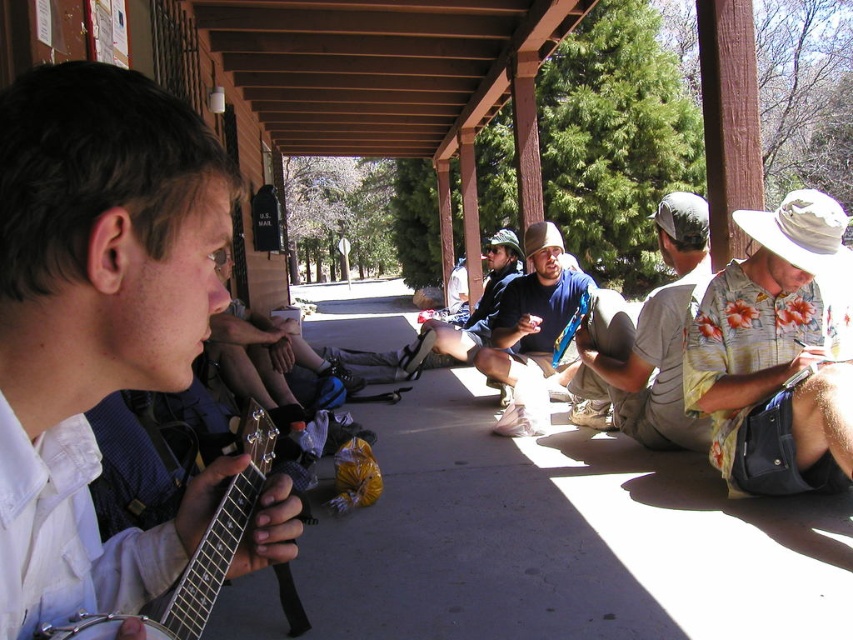
Which of these two, floral cotton shirt at right or gray striped shirt at center, stands taller?

gray striped shirt at center

Does floral cotton shirt at right appear on the right side of gray striped shirt at center?

Yes, floral cotton shirt at right is to the right of gray striped shirt at center.

Describe the element at coordinates (776, 352) in the screenshot. The height and width of the screenshot is (640, 853). I see `floral cotton shirt at right` at that location.

You are a GUI agent. You are given a task and a screenshot of the screen. Output one action in this format:
    pyautogui.click(x=<x>, y=<y>)
    Task: Click on the floral cotton shirt at right
    This screenshot has width=853, height=640.
    Given the screenshot: What is the action you would take?
    pyautogui.click(x=776, y=352)

Who is positioned more to the right, blue denim jeans at center or dark blue denim shorts at center?

blue denim jeans at center

Does blue denim jeans at center appear over dark blue denim shorts at center?

Actually, blue denim jeans at center is below dark blue denim shorts at center.

Which is in front, point (550, 291) or point (479, 314)?

Positioned in front is point (550, 291).

Find the location of a particular element. The height and width of the screenshot is (640, 853). blue denim jeans at center is located at coordinates (532, 330).

Who is more distant from viewer, (22, 442) or (685, 438)?

The point (685, 438) is more distant.

Where is `matte black guitar at left`? Image resolution: width=853 pixels, height=640 pixels. matte black guitar at left is located at coordinates (97, 321).

Locate an element on the screen. The image size is (853, 640). matte black guitar at left is located at coordinates (97, 321).